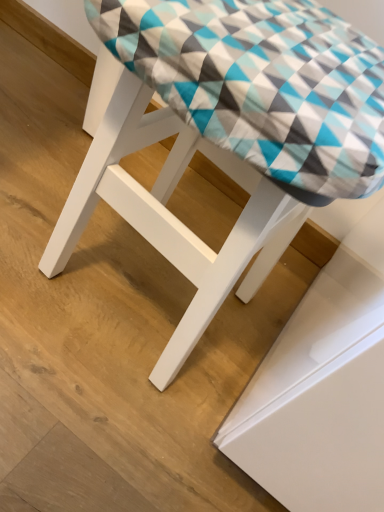
This screenshot has height=512, width=384. I want to click on vacant space situated on the left part of white matte stool at center, so click(x=39, y=182).